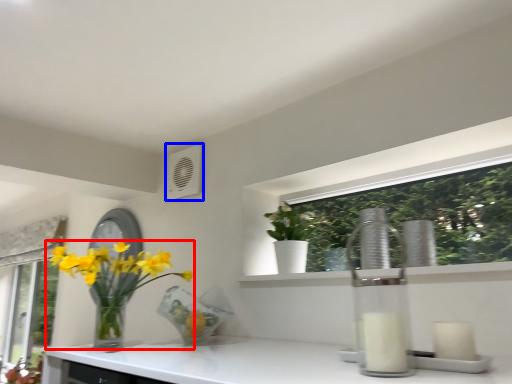
Question: Which of the following is the farthest to the observer, houseplant (highlighted by a red box) or air conditioning (highlighted by a blue box)?

Choices:
 (A) houseplant
 (B) air conditioning

Answer: (B)